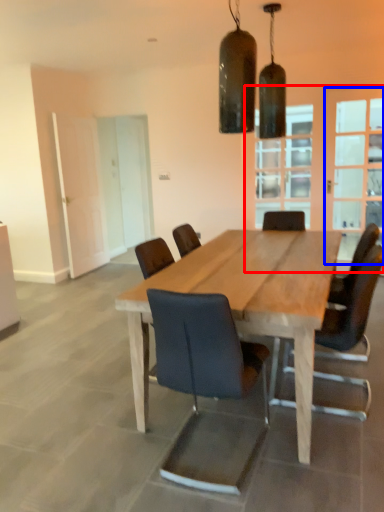
Question: Which of the following is the closest to the observer, glass door (highlighted by a red box) or glass door (highlighted by a blue box)?

Choices:
 (A) glass door
 (B) glass door

Answer: (A)